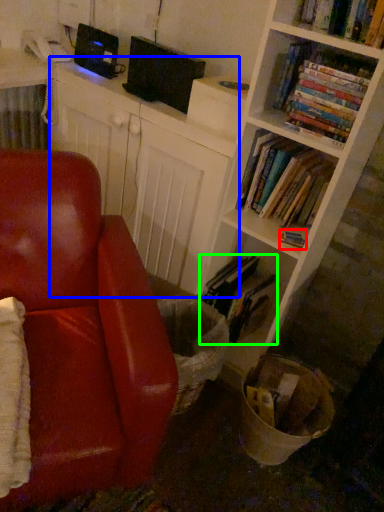
Question: Which object is positioned closest to book (highlighted by a red box)? Select from computer (highlighted by a blue box) and book (highlighted by a green box).

Choices:
 (A) computer
 (B) book

Answer: (B)